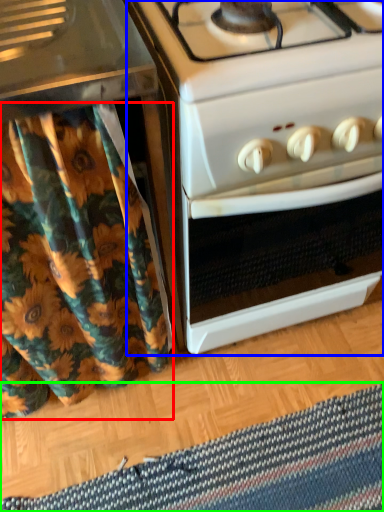
Question: Which object is positioned farthest from shower curtain (highlighted by a red box)? Select from oven (highlighted by a blue box) and mat (highlighted by a green box).

Choices:
 (A) oven
 (B) mat

Answer: (B)